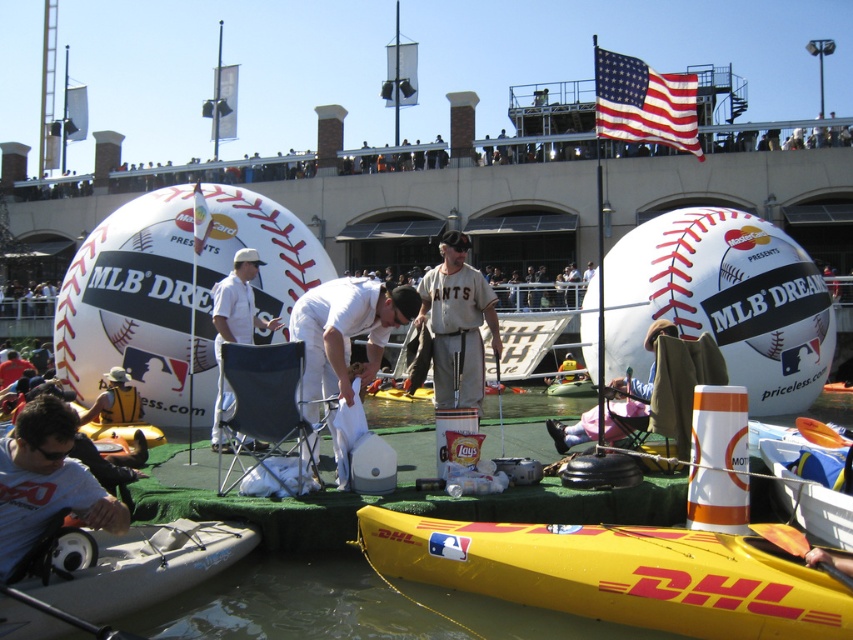
You are a photographer at the event and need to capture a clear photo of both the white matte baseball cap at center and the yellow rubber paddle at lower right. Since you want the cap to appear larger in the photo than the paddle, where should you position your camera relative to the objects?

The white matte baseball cap at center is taller than the yellow rubber paddle at lower right. To make the cap appear larger in the photo, position the camera closer to the white matte baseball cap at center while keeping both objects in frame.

You are a photographer standing at the center of the stage setup. You want to take a photo that includes both the point at coordinates point (x=181, y=536) and point (x=380, y=336). Which point should you focus on first to ensure both are in sharp focus?

You should focus on point (x=181, y=536) first because it is closer to the camera than point (x=380, y=336). This ensures the closer point is in focus, and the farther point will also be within the depth of field.